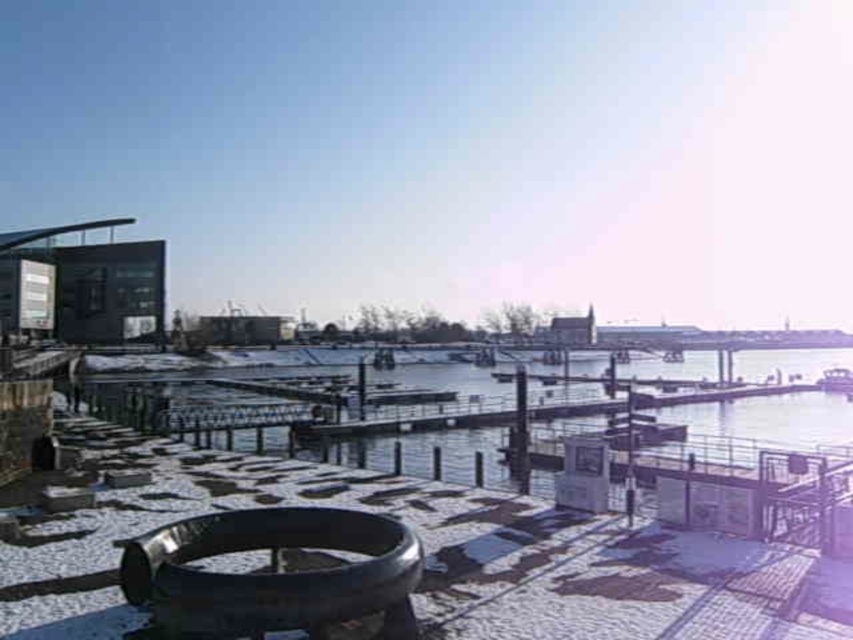
You are standing at the waterfront and see the point marked at coordinates [273,573]. What object is located at that point?

The point at coordinates [273,573] marks the shiny black tire at lower center.

You are standing on the snow covered ground and want to walk from the shiny black tire at lower center to the metallic silver boat at lower right. Is the boat visible from your current position?

The shiny black tire at lower center is positioned over metallic silver boat at lower right, so the boat is partially or fully obscured by the tire from your current position.

You are a delivery drone with a maximum flight range of 60 meters. You need to deliver a package from the shiny black tire at lower center to the metallic silver boat at lower right. Can you complete the delivery without needing to recharge?

The shiny black tire at lower center is 63.39 meters from the metallic silver boat at lower right. Since the distance exceeds the drone s 60 meter range, the drone cannot complete the delivery without recharging.